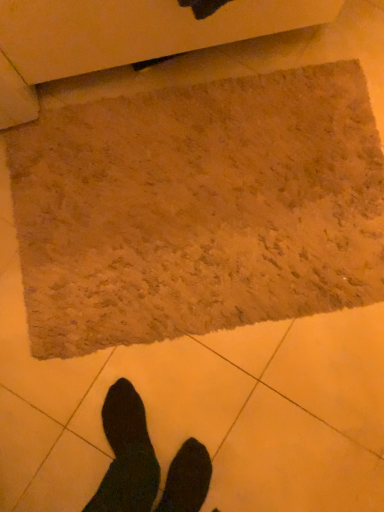
The width and height of the screenshot is (384, 512). Identify the location of vacant space situated above beige shaggy rug at center (from a real-world perspective). (193, 204).